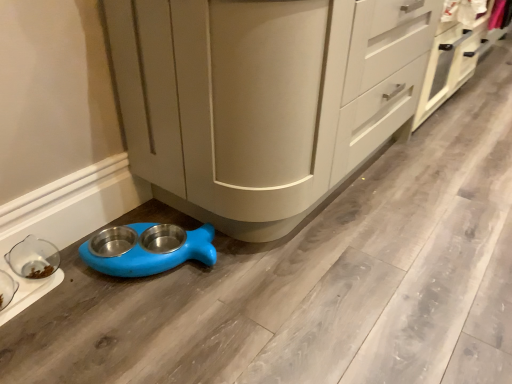
Question: Is blue plastic pet feeder at lower left, the 1th appliance positioned from the right, turned away from matte beige cabinet at lower center, the first cabinetry in the left-to-right sequence?

Choices:
 (A) yes
 (B) no

Answer: (A)

Question: Is blue plastic pet feeder at lower left, the 1th appliance positioned from the right, not within matte beige cabinet at lower center, marked as the second cabinetry in a right-to-left arrangement?

Choices:
 (A) no
 (B) yes

Answer: (B)

Question: Is blue plastic pet feeder at lower left, which is the 2th appliance from left to right, further to the viewer compared to matte beige cabinet at lower center, the first cabinetry in the left-to-right sequence?

Choices:
 (A) no
 (B) yes

Answer: (B)

Question: From the image's perspective, would you say blue plastic pet feeder at lower left, the 1th appliance positioned from the right, is positioned over matte beige cabinet at lower center, the first cabinetry in the left-to-right sequence?

Choices:
 (A) yes
 (B) no

Answer: (B)

Question: Is blue plastic pet feeder at lower left, the 1th appliance positioned from the right, far from matte beige cabinet at lower center, marked as the second cabinetry in a right-to-left arrangement?

Choices:
 (A) no
 (B) yes

Answer: (A)

Question: From the image's perspective, relative to matte beige cabinet at lower center, the first cabinetry in the left-to-right sequence, is blue plastic pet feeder at lower left, the 1th appliance positioned from the right, above or below?

Choices:
 (A) above
 (B) below

Answer: (B)

Question: Is blue plastic pet feeder at lower left, which is the 2th appliance from left to right, bigger or smaller than matte beige cabinet at lower center, marked as the second cabinetry in a right-to-left arrangement?

Choices:
 (A) big
 (B) small

Answer: (B)

Question: Is blue plastic pet feeder at lower left, the 1th appliance positioned from the right, spatially inside matte beige cabinet at lower center, the first cabinetry in the left-to-right sequence, or outside of it?

Choices:
 (A) outside
 (B) inside

Answer: (A)

Question: From a real-world perspective, is blue plastic pet feeder at lower left, the 1th appliance positioned from the right, positioned above or below matte beige cabinet at lower center, marked as the second cabinetry in a right-to-left arrangement?

Choices:
 (A) above
 (B) below

Answer: (B)

Question: From a real-world perspective, is blue plastic pet feeder at lower left, which is the 2th appliance from left to right, positioned above or below white matte cabinet at center, which is counted as the second cabinetry, starting from the left?

Choices:
 (A) below
 (B) above

Answer: (A)

Question: From their relative heights in the image, would you say blue plastic pet feeder at lower left, which is the 2th appliance from left to right, is taller or shorter than white matte cabinet at center, which is counted as the second cabinetry, starting from the left?

Choices:
 (A) short
 (B) tall

Answer: (A)

Question: Looking at the image, does blue plastic pet feeder at lower left, which is the 2th appliance from left to right, seem bigger or smaller compared to white matte cabinet at center, the 1th cabinetry when ordered from right to left?

Choices:
 (A) big
 (B) small

Answer: (B)

Question: Is blue plastic pet feeder at lower left, the 1th appliance positioned from the right, spatially inside white matte cabinet at center, which is counted as the second cabinetry, starting from the left, or outside of it?

Choices:
 (A) outside
 (B) inside

Answer: (A)

Question: Considering their positions, is white matte cabinet at center, which is counted as the second cabinetry, starting from the left, located in front of or behind blue plastic pet feeder at lower left, which is the 2th appliance from left to right?

Choices:
 (A) behind
 (B) front

Answer: (A)

Question: In the image, is white matte cabinet at center, the 1th cabinetry when ordered from right to left, on the left side or the right side of blue plastic pet feeder at lower left, the 1th appliance positioned from the right?

Choices:
 (A) right
 (B) left

Answer: (A)